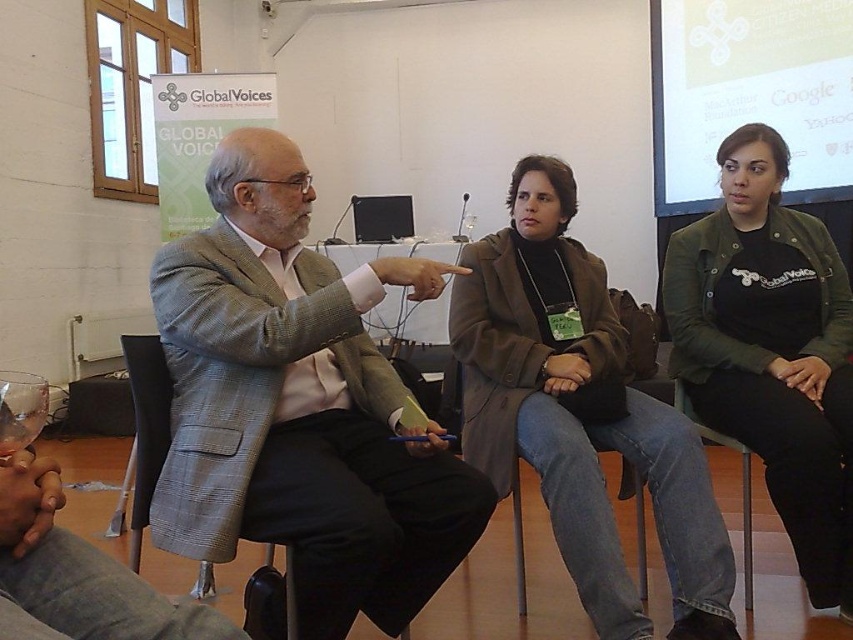
Question: Does gray wool suit at center have a larger size compared to green matte jacket at center?

Choices:
 (A) no
 (B) yes

Answer: (B)

Question: Does gray wool suit at center appear on the right side of brown textured coat at center?

Choices:
 (A) yes
 (B) no

Answer: (B)

Question: Is the position of gray wool suit at center more distant than that of brown textured coat at center?

Choices:
 (A) yes
 (B) no

Answer: (B)

Question: Which object is the closest to the gray wool suit at center?

Choices:
 (A) brown textured coat at center
 (B) matte white screen at upper right
 (C) green matte jacket at center
 (D) gray fabric chair at lower left

Answer: (D)

Question: Which point is farther to the camera?

Choices:
 (A) (839, 602)
 (B) (512, 189)
 (C) (780, 51)
 (D) (288, 566)

Answer: (C)

Question: Which point is farther to the camera?

Choices:
 (A) (782, 100)
 (B) (757, 145)
 (C) (550, 177)
 (D) (281, 577)

Answer: (A)